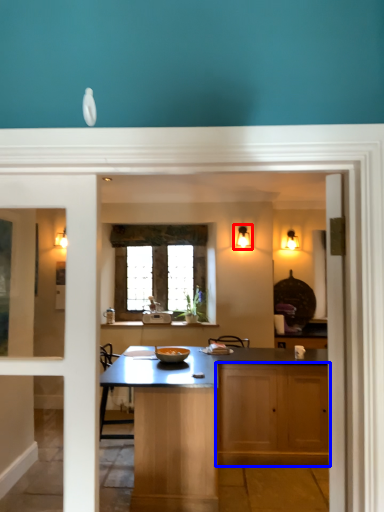
Question: Which point is further to the camera, light fixture (highlighted by a red box) or cabinetry (highlighted by a blue box)?

Choices:
 (A) light fixture
 (B) cabinetry

Answer: (A)